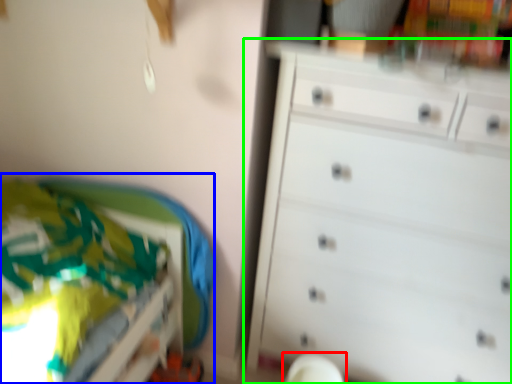
Question: Which object is positioned farthest from swivel chair (highlighted by a red box)? Select from bed (highlighted by a blue box) and chest of drawers (highlighted by a green box).

Choices:
 (A) bed
 (B) chest of drawers

Answer: (A)